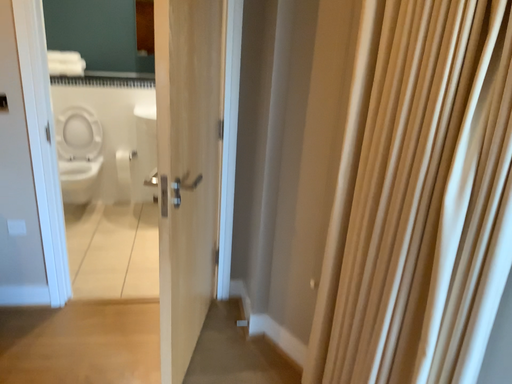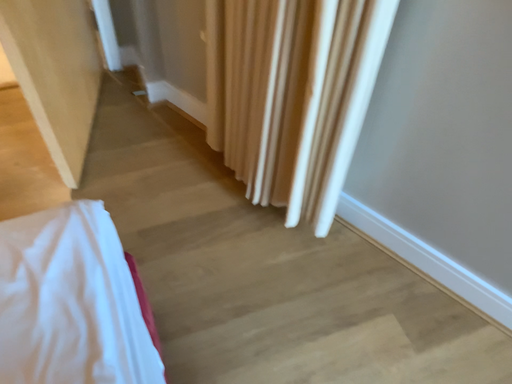
Question: How did the camera likely rotate when shooting the video?

Choices:
 (A) rotated left
 (B) rotated right

Answer: (B)